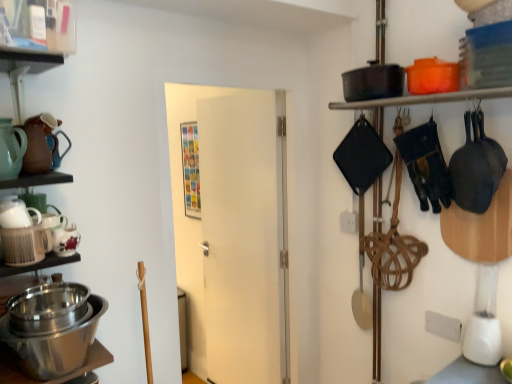
Question: Can you confirm if matte ceramic teapot at left, arranged as the 2th tea pot when viewed from the top, is positioned to the left of matte black pot at upper right, which is counted as the 2th shelf, starting from the top?

Choices:
 (A) no
 (B) yes

Answer: (B)

Question: Is matte ceramic teapot at left, arranged as the third tea pot when ordered from the bottom, with matte black pot at upper right, which is counted as the 2th shelf, starting from the top?

Choices:
 (A) yes
 (B) no

Answer: (B)

Question: Is matte ceramic teapot at left, arranged as the third tea pot when ordered from the bottom, closer to the viewer compared to matte black pot at upper right, the first shelf in the bottom-to-top sequence?

Choices:
 (A) no
 (B) yes

Answer: (B)

Question: From a real-world perspective, is matte ceramic teapot at left, arranged as the third tea pot when ordered from the bottom, positioned over matte black pot at upper right, the first shelf in the bottom-to-top sequence, based on gravity?

Choices:
 (A) no
 (B) yes

Answer: (A)

Question: Does matte ceramic teapot at left, arranged as the 2th tea pot when viewed from the top, appear on the right side of matte black pot at upper right, the first shelf in the bottom-to-top sequence?

Choices:
 (A) no
 (B) yes

Answer: (A)

Question: Visually, is matte black pot at upper right, which ranks as the 1th shelf in back-to-front order, positioned to the left or to the right of white matte door at center?

Choices:
 (A) right
 (B) left

Answer: (A)

Question: Is matte black pot at upper right, which is counted as the first shelf, starting from the right, inside or outside of white matte door at center?

Choices:
 (A) inside
 (B) outside

Answer: (B)

Question: From a real-world perspective, is matte black pot at upper right, which is counted as the first shelf, starting from the right, above or below white matte door at center?

Choices:
 (A) above
 (B) below

Answer: (A)

Question: From the image's perspective, relative to white matte door at center, is matte black pot at upper right, which is counted as the first shelf, starting from the right, above or below?

Choices:
 (A) above
 (B) below

Answer: (A)

Question: From a real-world perspective, is clear plastic container at upper left, the 1th shelf viewed from the left, above or below white matte door at center?

Choices:
 (A) below
 (B) above

Answer: (B)

Question: From their relative heights in the image, would you say clear plastic container at upper left, the 1th shelf viewed from the left, is taller or shorter than white matte door at center?

Choices:
 (A) tall
 (B) short

Answer: (B)

Question: Relative to white matte door at center, is clear plastic container at upper left, which is the 2th shelf in bottom-to-top order, in front or behind?

Choices:
 (A) front
 (B) behind

Answer: (A)

Question: Is point (20, 56) positioned closer to the camera than point (181, 230)?

Choices:
 (A) farther
 (B) closer

Answer: (B)

Question: Considering the positions of white matte door at center and ceramic tea pot at lower left, marked as the first tea pot in a bottom-to-top arrangement, in the image, is white matte door at center taller or shorter than ceramic tea pot at lower left, marked as the first tea pot in a bottom-to-top arrangement,?

Choices:
 (A) tall
 (B) short

Answer: (A)

Question: From the image's perspective, is white matte door at center located above or below ceramic tea pot at lower left, marked as the first tea pot in a bottom-to-top arrangement?

Choices:
 (A) below
 (B) above

Answer: (A)